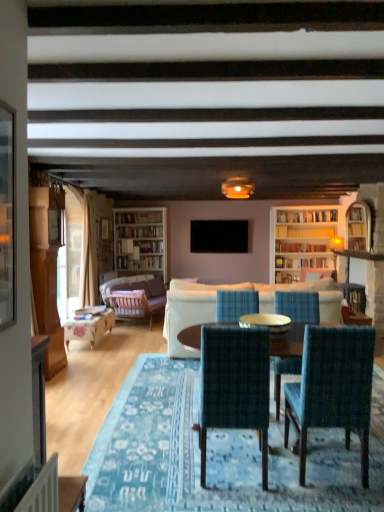
Question: Could white wooden bookcase at left be considered to be inside wooden floral-patterned table at left?

Choices:
 (A) yes
 (B) no

Answer: (B)

Question: From a real-world perspective, is wooden floral-patterned table at left physically below white wooden bookcase at left?

Choices:
 (A) no
 (B) yes

Answer: (B)

Question: From the image's perspective, would you say wooden floral-patterned table at left is shown under white wooden bookcase at left?

Choices:
 (A) no
 (B) yes

Answer: (B)

Question: Can we say wooden floral-patterned table at left lies outside white wooden bookcase at left?

Choices:
 (A) no
 (B) yes

Answer: (B)

Question: Is wooden floral-patterned table at left aimed at white wooden bookcase at left?

Choices:
 (A) yes
 (B) no

Answer: (B)

Question: Can you confirm if wooden floral-patterned table at left is taller than white wooden bookcase at left?

Choices:
 (A) no
 (B) yes

Answer: (A)

Question: Can you confirm if white fabric couch at center, which is counted as the 2th studio couch, starting from the back, is wider than blue woven chair at center, which is counted as the 3th chair, starting from the front?

Choices:
 (A) yes
 (B) no

Answer: (A)

Question: Does white fabric couch at center, positioned as the 1th studio couch in front-to-back order, appear on the right side of blue woven chair at center, which is counted as the 3th chair, starting from the front?

Choices:
 (A) yes
 (B) no

Answer: (A)

Question: Is white fabric couch at center, the second studio couch when ordered from left to right, outside blue woven chair at center, acting as the 1th chair starting from the back?

Choices:
 (A) yes
 (B) no

Answer: (A)

Question: Is blue woven chair at center, acting as the 1th chair starting from the back, at the back of white fabric couch at center, the second studio couch when ordered from left to right?

Choices:
 (A) no
 (B) yes

Answer: (B)

Question: Could you tell me if white fabric couch at center, which is counted as the 2th studio couch, starting from the back, is turned towards blue woven chair at center, acting as the 1th chair starting from the back?

Choices:
 (A) no
 (B) yes

Answer: (A)

Question: From the image's perspective, is white fabric couch at center, which is counted as the 2th studio couch, starting from the back, over blue woven chair at center, acting as the 1th chair starting from the back?

Choices:
 (A) yes
 (B) no

Answer: (B)

Question: Does wooden floral-patterned table at left have a lesser height compared to clear glass table at center?

Choices:
 (A) no
 (B) yes

Answer: (A)